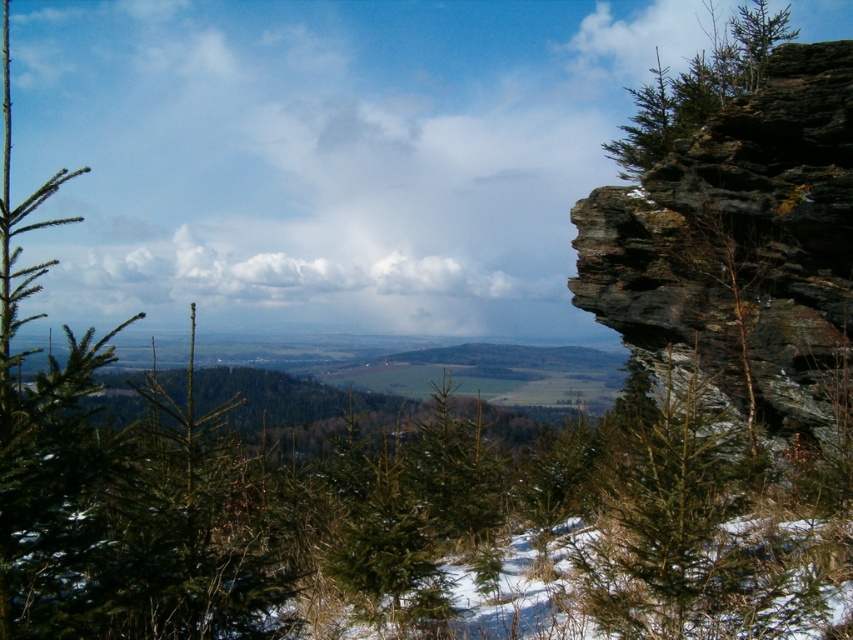
Question: From the image, what is the correct spatial relationship of green matte tree at right in relation to green matte tree at upper right?

Choices:
 (A) above
 (B) below

Answer: (B)

Question: Can you confirm if green matte tree at right is wider than green matte tree at upper right?

Choices:
 (A) no
 (B) yes

Answer: (A)

Question: Is green matte tree at right positioned before green matte tree at upper right?

Choices:
 (A) yes
 (B) no

Answer: (A)